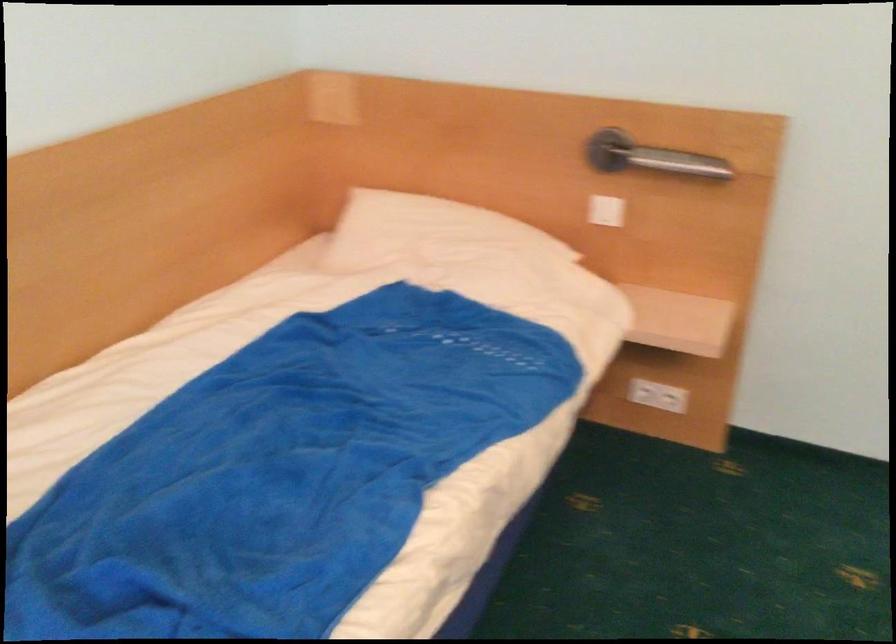
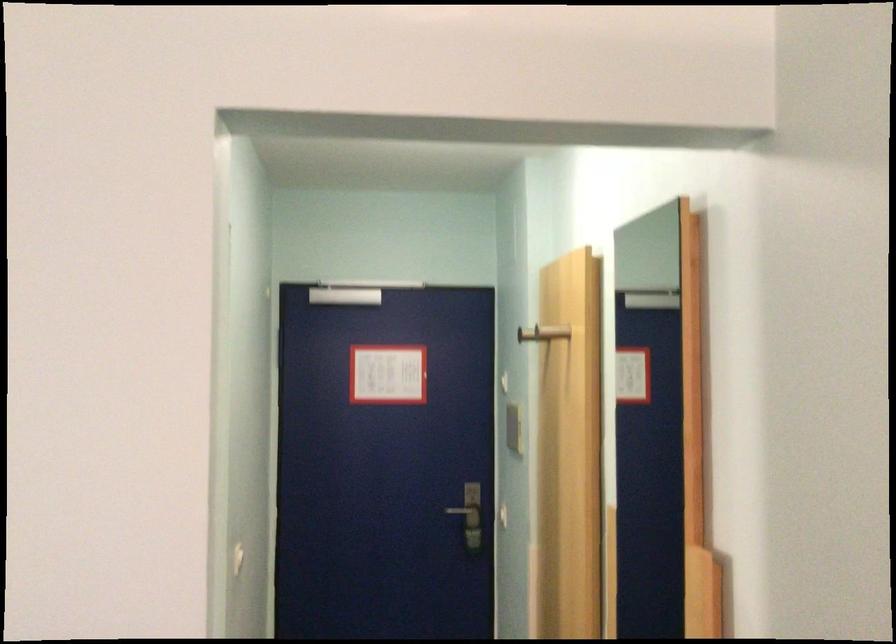
First-person continuous shooting, in which direction is the camera rotating?

The camera rotated toward right-up.